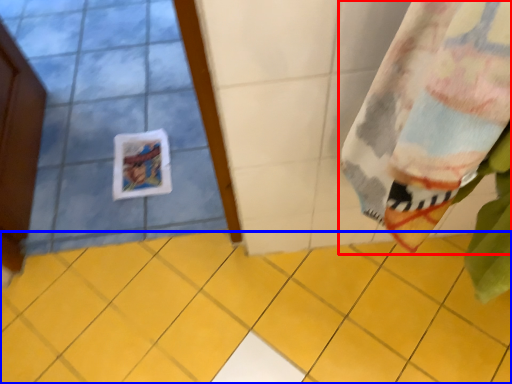
Question: Which point is closer to the camera, curtain (highlighted by a red box) or ceramic tile (highlighted by a blue box)?

Choices:
 (A) curtain
 (B) ceramic tile

Answer: (A)